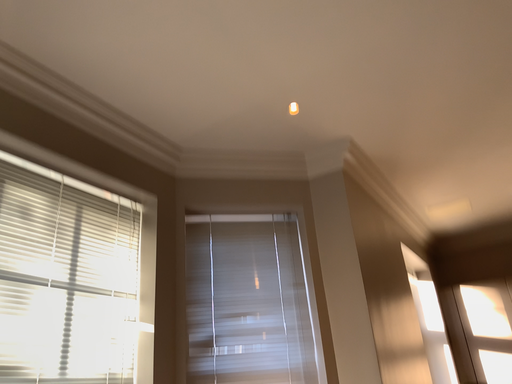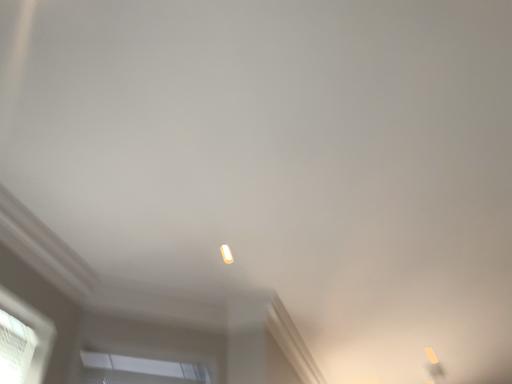
Question: How did the camera likely rotate when shooting the video?

Choices:
 (A) rotated upward
 (B) rotated downward

Answer: (A)